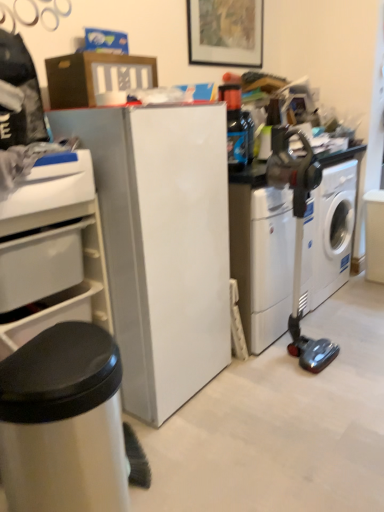
The image size is (384, 512). I want to click on translucent plastic bottle at upper center, so click(x=235, y=127).

From the picture: Measure the distance between white glossy refrigerator at center and camera.

4.33 feet.

Locate an element on the screen. This screenshot has width=384, height=512. white glossy refrigerator at center is located at coordinates (162, 244).

Measure the distance between white plastic drawer at left and camera.

white plastic drawer at left is 1.19 meters from camera.

The image size is (384, 512). What do you see at coordinates (262, 260) in the screenshot?
I see `white plastic washing machine at center-right, placed as the second washing machine when sorted from right to left` at bounding box center [262, 260].

I want to click on translucent plastic bottle at upper center, so click(235, 127).

Can white plastic drawer at left be found inside metallic gray vacuum cleaner at right?

Actually, white plastic drawer at left is outside metallic gray vacuum cleaner at right.

Who is taller, metallic gray vacuum cleaner at right or white plastic drawer at left?

metallic gray vacuum cleaner at right is taller.

In the scene shown: From a real-world perspective, is metallic gray vacuum cleaner at right located higher than white plastic drawer at left?

No, from a real-world perspective, metallic gray vacuum cleaner at right is not on top of white plastic drawer at left.

Which object is positioned more to the left, metallic gray vacuum cleaner at right or white plastic drawer at left?

white plastic drawer at left.

From the picture: Which of these two, metallic gray vacuum cleaner at right or white glossy refrigerator at center, is bigger?

white glossy refrigerator at center.

Is point (297, 335) closer to camera compared to point (208, 176)?

That is False.

Looking at this image, is metallic gray vacuum cleaner at right completely or partially outside of white glossy refrigerator at center?

Yes.

Considering the relative sizes of metallic gray vacuum cleaner at right and white glossy refrigerator at center in the image provided, is metallic gray vacuum cleaner at right shorter than white glossy refrigerator at center?

Yes, metallic gray vacuum cleaner at right is shorter than white glossy refrigerator at center.

From their relative heights in the image, would you say white glossy refrigerator at center is taller or shorter than white glossy washing machine at right, marked as the second washing machine in a left-to-right arrangement?

Clearly, white glossy refrigerator at center is taller compared to white glossy washing machine at right, marked as the second washing machine in a left-to-right arrangement.

Can you confirm if white glossy refrigerator at center is wider than white glossy washing machine at right, marked as the second washing machine in a left-to-right arrangement?

Indeed, white glossy refrigerator at center has a greater width compared to white glossy washing machine at right, marked as the second washing machine in a left-to-right arrangement.

Is white glossy refrigerator at center next to white glossy washing machine at right, positioned as the first washing machine in right-to-left order?

white glossy refrigerator at center and white glossy washing machine at right, positioned as the first washing machine in right-to-left order, are clearly separated.

Could you measure the distance between white glossy refrigerator at center and white glossy washing machine at right, positioned as the first washing machine in right-to-left order?

They are 1.06 meters apart.

Is there a large distance between white plastic drawer at lower left and white glossy refrigerator at center?

No, white plastic drawer at lower left is not far from white glossy refrigerator at center.

Would you say white plastic drawer at lower left is inside or outside white glossy refrigerator at center?

white plastic drawer at lower left lies outside white glossy refrigerator at center.

Between white plastic drawer at lower left and white glossy refrigerator at center, which one is positioned in front?

white plastic drawer at lower left is more forward.

Looking at this image, from a real-world perspective, is white plastic drawer at lower left on white glossy refrigerator at center?

Yes, from a real-world perspective, white plastic drawer at lower left is on top of white glossy refrigerator at center.

From a real-world perspective, who is located lower, white plastic washing machine at center-right, placed as the second washing machine when sorted from right to left, or translucent plastic bottle at upper center?

white plastic washing machine at center-right, placed as the second washing machine when sorted from right to left, is physically lower.

Is white plastic washing machine at center-right, placed as the second washing machine when sorted from right to left, in contact with translucent plastic bottle at upper center?

No, white plastic washing machine at center-right, placed as the second washing machine when sorted from right to left, is not making contact with translucent plastic bottle at upper center.

Is white plastic washing machine at center-right, the first washing machine in the left-to-right sequence, wider or thinner than translucent plastic bottle at upper center?

white plastic washing machine at center-right, the first washing machine in the left-to-right sequence, is wider than translucent plastic bottle at upper center.

In the scene shown: Is translucent plastic bottle at upper center far from white plastic drawer at left?

That's not correct — translucent plastic bottle at upper center is a little close to white plastic drawer at left.

Based on the photo, from a real-world perspective, does translucent plastic bottle at upper center sit lower than white plastic drawer at left?

Incorrect, from a real-world perspective, translucent plastic bottle at upper center is higher than white plastic drawer at left.

Looking at this image, from the image's perspective, is translucent plastic bottle at upper center beneath white plastic drawer at left?

No, from the image's perspective, translucent plastic bottle at upper center is not below white plastic drawer at left.

Is white plastic drawer at lower left smaller than white plastic washing machine at center-right, placed as the second washing machine when sorted from right to left?

Correct, white plastic drawer at lower left occupies less space than white plastic washing machine at center-right, placed as the second washing machine when sorted from right to left.

From a real-world perspective, does white plastic drawer at lower left stand above white plastic washing machine at center-right, placed as the second washing machine when sorted from right to left?

Correct, in the physical world, white plastic drawer at lower left is higher than white plastic washing machine at center-right, placed as the second washing machine when sorted from right to left.

Considering the positions of objects white plastic drawer at lower left and white plastic washing machine at center-right, the first washing machine in the left-to-right sequence, in the image provided, who is in front, white plastic drawer at lower left or white plastic washing machine at center-right, the first washing machine in the left-to-right sequence,?

white plastic drawer at lower left.

I want to click on washing machine that is the 1st object to the right of the white plastic drawer at lower left, starting at the anchor, so click(x=262, y=260).

I want to click on sewing machine behind the white plastic drawer at left, so click(299, 234).

Image resolution: width=384 pixels, height=512 pixels. In order to click on refrigerator on the left of metallic gray vacuum cleaner at right in this screenshot , I will do `click(162, 244)`.

Which object lies further to the anchor point white plastic drawer at lower left, silver metallic trash can at lower left or white plastic washing machine at center-right, the first washing machine in the left-to-right sequence?

white plastic washing machine at center-right, the first washing machine in the left-to-right sequence, is positioned further to the anchor white plastic drawer at lower left.

Estimate the real-world distances between objects in this image. Which object is further from translucent plastic bottle at upper center, silver metallic trash can at lower left or white plastic washing machine at center-right, placed as the second washing machine when sorted from right to left?

silver metallic trash can at lower left.

Considering their positions, is metallic gray vacuum cleaner at right positioned further to translucent plastic bottle at upper center than silver metallic trash can at lower left?

The object further to translucent plastic bottle at upper center is silver metallic trash can at lower left.

Based on their spatial positions, is white plastic drawer at left or translucent plastic bottle at upper center closer to white glossy refrigerator at center?

Among the two, white plastic drawer at left is located nearer to white glossy refrigerator at center.

Which object lies nearer to the anchor point white plastic washing machine at center-right, placed as the second washing machine when sorted from right to left, white glossy washing machine at right, positioned as the first washing machine in right-to-left order, or white plastic drawer at left?

white glossy washing machine at right, positioned as the first washing machine in right-to-left order, lies closer to white plastic washing machine at center-right, placed as the second washing machine when sorted from right to left, than the other object.

Which object lies nearer to the anchor point white plastic washing machine at center-right, the first washing machine in the left-to-right sequence, white plastic drawer at left or white glossy washing machine at right, marked as the second washing machine in a left-to-right arrangement?

The object closer to white plastic washing machine at center-right, the first washing machine in the left-to-right sequence, is white glossy washing machine at right, marked as the second washing machine in a left-to-right arrangement.

Based on the photo, estimate the real-world distances between objects in this image. Which object is closer to white glossy washing machine at right, marked as the second washing machine in a left-to-right arrangement, white glossy refrigerator at center or translucent plastic bottle at upper center?

translucent plastic bottle at upper center is closer to white glossy washing machine at right, marked as the second washing machine in a left-to-right arrangement.

Based on the photo, which object lies further to the anchor point white plastic washing machine at center-right, placed as the second washing machine when sorted from right to left, white plastic drawer at lower left or metallic gray vacuum cleaner at right?

white plastic drawer at lower left.

Locate an element on the screen. Image resolution: width=384 pixels, height=512 pixels. home appliance between white plastic drawer at lower left and silver metallic trash can at lower left in the up-down direction is located at coordinates (51, 251).

Find the location of a particular element. The width and height of the screenshot is (384, 512). sewing machine between white glossy refrigerator at center and white glossy washing machine at right, positioned as the first washing machine in right-to-left order is located at coordinates [x=299, y=234].

You are a GUI agent. You are given a task and a screenshot of the screen. Output one action in this format:
    pyautogui.click(x=<x>, y=<y>)
    Task: Click on the washing machine situated between white glossy refrigerator at center and white glossy washing machine at right, positioned as the first washing machine in right-to-left order, from left to right
    This screenshot has width=384, height=512.
    Given the screenshot: What is the action you would take?
    pyautogui.click(x=262, y=260)

This screenshot has width=384, height=512. Find the location of `bottle between white plastic drawer at left and metallic gray vacuum cleaner at right`. bottle between white plastic drawer at left and metallic gray vacuum cleaner at right is located at coordinates (x=235, y=127).